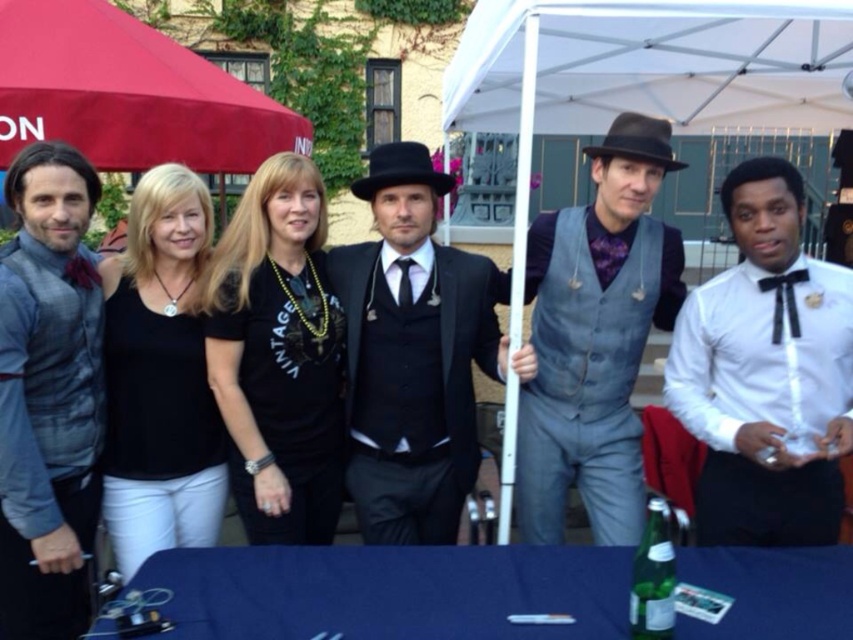
Which is more to the left, blue fabric table at lower center or white satin shirt at right?

blue fabric table at lower center is more to the left.

Between point (267, 589) and point (735, 332), which one is positioned behind?

The point (735, 332) is behind.

I want to click on blue fabric table at lower center, so click(x=390, y=592).

Which is above, white fabric canopy at upper center or brushed metal vest at left?

Positioned higher is white fabric canopy at upper center.

Is white fabric canopy at upper center bigger than brushed metal vest at left?

Yes, white fabric canopy at upper center is bigger than brushed metal vest at left.

Based on the photo, measure the distance between point (734, 83) and camera.

16.46 feet

Find the location of a particular element. Image resolution: width=853 pixels, height=640 pixels. white fabric canopy at upper center is located at coordinates (650, 64).

Can you confirm if brushed metal vest at left is positioned to the right of red fabric umbrella at upper left?

Indeed, brushed metal vest at left is positioned on the right side of red fabric umbrella at upper left.

Does point (26, 163) lie behind point (88, 13)?

No, (26, 163) is closer to viewer.

Who is more distant from viewer, [73,392] or [294,115]?

The point [294,115] is more distant.

At what (x,y) coordinates should I click in order to perform the action: click on brushed metal vest at left. Please return your answer as a coordinate pair (x, y). The width and height of the screenshot is (853, 640). Looking at the image, I should click on (48, 394).